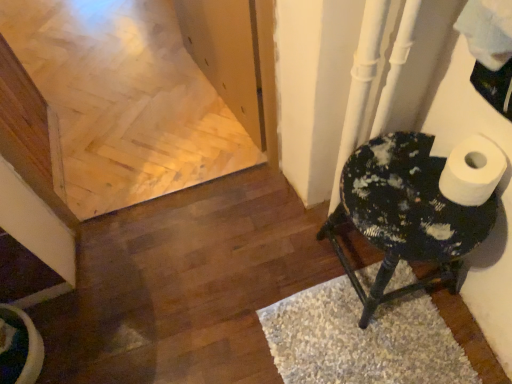
Identify the location of vacant space that is to the left of speckled black stool at right. This screenshot has width=512, height=384. (279, 261).